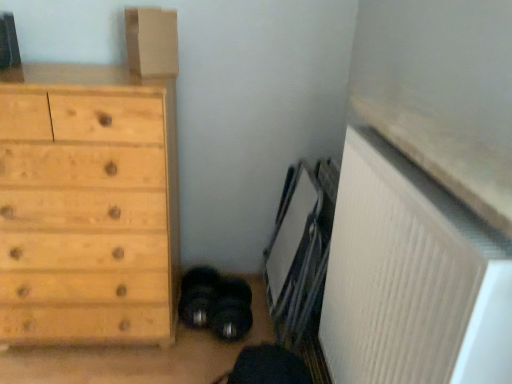
What do you see at coordinates (151, 41) in the screenshot?
I see `matte cardboard box at upper left` at bounding box center [151, 41].

Locate an element on the screen. The width and height of the screenshot is (512, 384). natural wood chest of drawers at left is located at coordinates (87, 206).

Find the location of `matte cardboard box at upper left`. matte cardboard box at upper left is located at coordinates (151, 41).

Which is further, (108, 91) or (439, 241)?

The point (108, 91) is farther from the camera.

Is natural wood chest of drawers at left looking in the opposite direction of white ribbed radiator at lower right?

That's not correct — natural wood chest of drawers at left is not looking away from white ribbed radiator at lower right.

From a real-world perspective, is natural wood chest of drawers at left under white ribbed radiator at lower right?

Indeed, from a real-world perspective, natural wood chest of drawers at left is positioned beneath white ribbed radiator at lower right.

Is natural wood chest of drawers at left located outside white ribbed radiator at lower right?

Yes, natural wood chest of drawers at left is not within white ribbed radiator at lower right.

Is matte cardboard box at upper left wider or thinner than natural wood chest of drawers at left?

matte cardboard box at upper left is thinner than natural wood chest of drawers at left.

You are a GUI agent. You are given a task and a screenshot of the screen. Output one action in this format:
    pyautogui.click(x=<x>, y=<y>)
    Task: Click on the chest of drawers located below the matte cardboard box at upper left (from the image's perspective)
    The height and width of the screenshot is (384, 512).
    Given the screenshot: What is the action you would take?
    pyautogui.click(x=87, y=206)

Which object is further away from the camera, matte cardboard box at upper left or natural wood chest of drawers at left?

matte cardboard box at upper left is behind.

Between matte cardboard box at upper left and natural wood chest of drawers at left, which one has larger size?

natural wood chest of drawers at left.

Does white ribbed radiator at lower right lie in front of matte cardboard box at upper left?

Yes, white ribbed radiator at lower right is closer to the viewer.

Looking at this image, can you confirm if white ribbed radiator at lower right is thinner than matte cardboard box at upper left?

Incorrect, the width of white ribbed radiator at lower right is not less than that of matte cardboard box at upper left.

How much distance is there between white ribbed radiator at lower right and matte cardboard box at upper left?

They are 3.35 feet apart.

Would you say white ribbed radiator at lower right is a long distance from matte cardboard box at upper left?

Yes.

Is natural wood chest of drawers at left far away from matte cardboard box at upper left?

No.

Is natural wood chest of drawers at left turned away from matte cardboard box at upper left?

No, natural wood chest of drawers at left is not facing the opposite direction of matte cardboard box at upper left.

Can you confirm if natural wood chest of drawers at left is shorter than matte cardboard box at upper left?

Incorrect, the height of natural wood chest of drawers at left does not fall short of that of matte cardboard box at upper left.

Is point (80, 120) positioned in front of point (142, 49)?

Yes, it is in front of point (142, 49).

Considering the sizes of objects matte cardboard box at upper left and white ribbed radiator at lower right in the image provided, who is bigger, matte cardboard box at upper left or white ribbed radiator at lower right?

With larger size is white ribbed radiator at lower right.

Is the depth of matte cardboard box at upper left greater than that of white ribbed radiator at lower right?

Result: Yes, it is behind white ribbed radiator at lower right.

From the picture: In terms of height, does matte cardboard box at upper left look taller or shorter compared to white ribbed radiator at lower right?

Clearly, matte cardboard box at upper left is shorter compared to white ribbed radiator at lower right.

At what (x,y) coordinates should I click in order to perform the action: click on chest of drawers on the left of white ribbed radiator at lower right. Please return your answer as a coordinate pair (x, y). Looking at the image, I should click on (87, 206).

Considering the sizes of objects white ribbed radiator at lower right and natural wood chest of drawers at left in the image provided, who is smaller, white ribbed radiator at lower right or natural wood chest of drawers at left?

white ribbed radiator at lower right.

Is white ribbed radiator at lower right not close to natural wood chest of drawers at left?

No, white ribbed radiator at lower right is in close proximity to natural wood chest of drawers at left.

The width and height of the screenshot is (512, 384). Find the location of `radiator on the right of natural wood chest of drawers at left`. radiator on the right of natural wood chest of drawers at left is located at coordinates (411, 278).

At what (x,y) coordinates should I click in order to perform the action: click on cardboard box behind the natural wood chest of drawers at left. Please return your answer as a coordinate pair (x, y). The width and height of the screenshot is (512, 384). Looking at the image, I should click on (151, 41).

Estimate the real-world distances between objects in this image. Which object is closer to matte cardboard box at upper left, natural wood chest of drawers at left or white ribbed radiator at lower right?

Among the two, natural wood chest of drawers at left is located nearer to matte cardboard box at upper left.

Looking at the image, which one is located closer to natural wood chest of drawers at left, white ribbed radiator at lower right or matte cardboard box at upper left?

matte cardboard box at upper left is positioned closer to the anchor natural wood chest of drawers at left.

Looking at the image, which one is located further to white ribbed radiator at lower right, matte cardboard box at upper left or natural wood chest of drawers at left?

matte cardboard box at upper left lies further to white ribbed radiator at lower right than the other object.

From the image, which object appears to be nearer to natural wood chest of drawers at left, matte cardboard box at upper left or white ribbed radiator at lower right?

matte cardboard box at upper left lies closer to natural wood chest of drawers at left than the other object.

In the scene shown: From the image, which object appears to be farther from matte cardboard box at upper left, white ribbed radiator at lower right or natural wood chest of drawers at left?

The object further to matte cardboard box at upper left is white ribbed radiator at lower right.

Looking at the image, which one is located closer to white ribbed radiator at lower right, natural wood chest of drawers at left or matte cardboard box at upper left?

Among the two, natural wood chest of drawers at left is located nearer to white ribbed radiator at lower right.

Where is `cardboard box between natural wood chest of drawers at left and white ribbed radiator at lower right`? This screenshot has width=512, height=384. cardboard box between natural wood chest of drawers at left and white ribbed radiator at lower right is located at coordinates (151, 41).